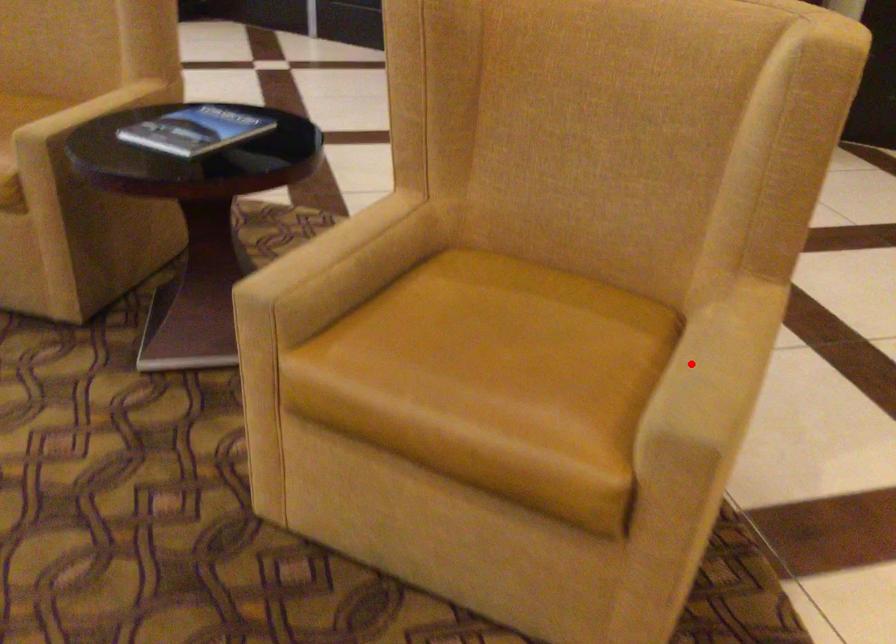
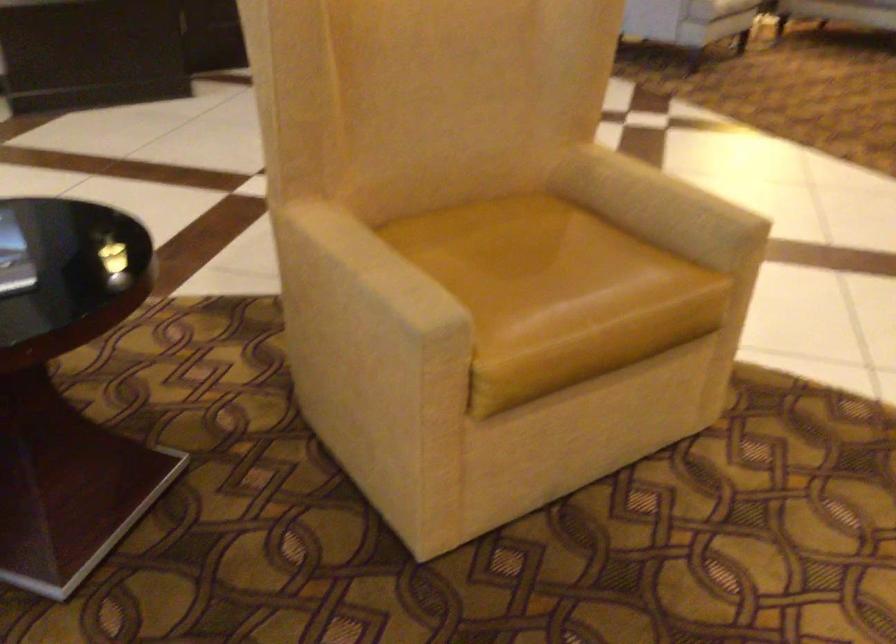
Question: I am providing you with two images of the same scene from different viewpoints. A red point is shown in image1. For the corresponding object point in image2, is it positioned nearer or farther from the camera?

Choices:
 (A) Nearer
 (B) Farther

Answer: (B)